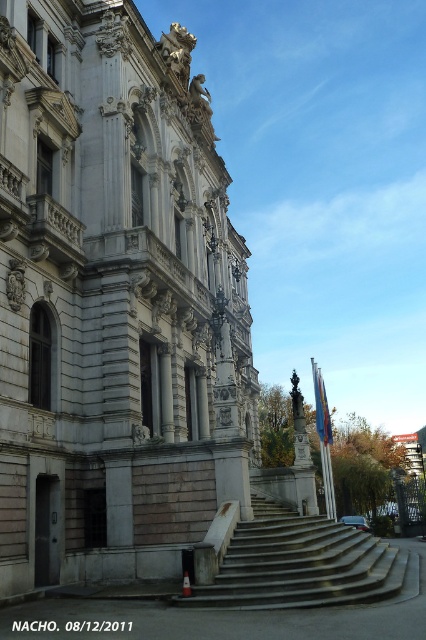
Based on the photo, which of these two, white stone palace at center or concrete stairs at center, stands taller?

white stone palace at center

Can you confirm if white stone palace at center is wider than concrete stairs at center?

Yes, white stone palace at center is wider than concrete stairs at center.

What do you see at coordinates (114, 300) in the screenshot?
I see `white stone palace at center` at bounding box center [114, 300].

At what (x,y) coordinates should I click in order to perform the action: click on white stone palace at center. Please return your answer as a coordinate pair (x, y). Looking at the image, I should click on (114, 300).